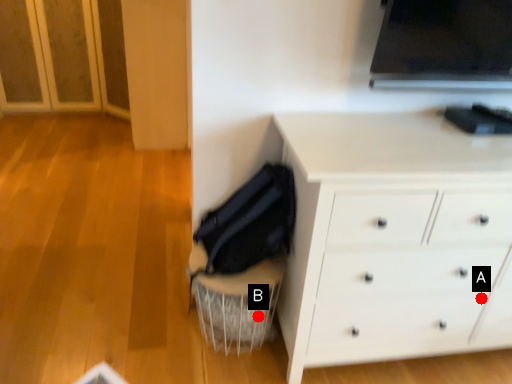
Question: Two points are circled on the image, labeled by A and B beside each circle. Among these points, which one is farthest from the camera?

Choices:
 (A) A is further
 (B) B is further

Answer: (B)